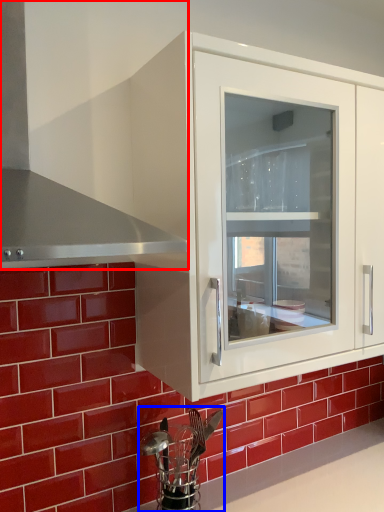
Question: Among these objects, which one is farthest to the camera, exhaust hood (highlighted by a red box) or appliance (highlighted by a blue box)?

Choices:
 (A) exhaust hood
 (B) appliance

Answer: (B)